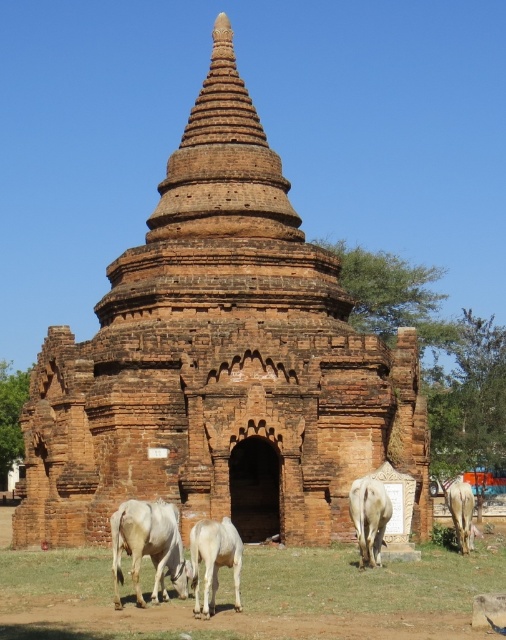
You are a farmer who needs to identify the smaller cow to give it more feed. Looking at the pagoda scene, which cow should you choose between the white smooth cow at lower left and the white smooth cow at lower right?

The white smooth cow at lower left is smaller in size compared to the white smooth cow at lower right, so you should choose the white smooth cow at lower left to give it more feed.

You are standing at the entrance of the pagoda and looking towards the grassy area. There is a point marked at coordinates (148, 547). What object does this point indicate?

The point at coordinates (148, 547) indicates the white smooth cow at lower left.